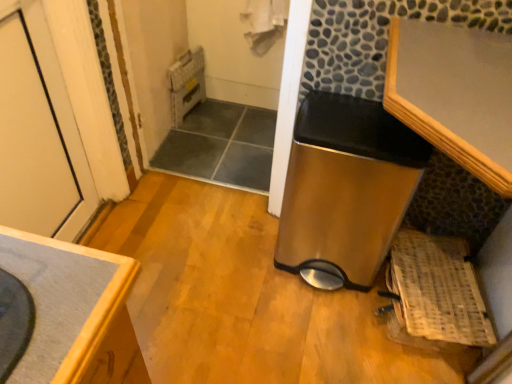
Question: In which direction should I rotate to look at stainless steel trash can at center, the 1th water heater positioned from the right?

Choices:
 (A) left
 (B) right

Answer: (B)

Question: From the image's perspective, is woven wood basket at lower right located beneath metallic gray water heater at upper center, which is the 2th water heater from bottom to top?

Choices:
 (A) no
 (B) yes

Answer: (B)

Question: Would you say metallic gray water heater at upper center, which is counted as the 2th water heater, starting from the front, is part of woven wood basket at lower right's contents?

Choices:
 (A) no
 (B) yes

Answer: (A)

Question: Considering the relative positions of woven wood basket at lower right and metallic gray water heater at upper center, which is the 1th water heater from top to bottom, in the image provided, is woven wood basket at lower right to the left of metallic gray water heater at upper center, which is the 1th water heater from top to bottom, from the viewer's perspective?

Choices:
 (A) yes
 (B) no

Answer: (B)

Question: Is woven wood basket at lower right bigger than metallic gray water heater at upper center, the 2th water heater from the right?

Choices:
 (A) no
 (B) yes

Answer: (B)

Question: Is metallic gray water heater at upper center, which is the 2th water heater from bottom to top, at the back of woven wood basket at lower right?

Choices:
 (A) yes
 (B) no

Answer: (B)

Question: Is there a large distance between woven wood basket at lower right and metallic gray water heater at upper center, the 2th water heater from the right?

Choices:
 (A) no
 (B) yes

Answer: (B)

Question: Is stainless steel trash can at center, which ranks as the 1th water heater in bottom-to-top order, smaller than metallic gray water heater at upper center, the first water heater viewed from the back?

Choices:
 (A) no
 (B) yes

Answer: (A)

Question: From a real-world perspective, is stainless steel trash can at center, the 1th water heater in the front-to-back sequence, physically above metallic gray water heater at upper center, which is counted as the 2th water heater, starting from the front?

Choices:
 (A) no
 (B) yes

Answer: (B)

Question: Is stainless steel trash can at center, arranged as the 2th water heater when viewed from the top, at the left side of metallic gray water heater at upper center, the first water heater viewed from the back?

Choices:
 (A) no
 (B) yes

Answer: (A)

Question: Is stainless steel trash can at center, the 1th water heater positioned from the right, bigger than metallic gray water heater at upper center, which is the 2th water heater from bottom to top?

Choices:
 (A) yes
 (B) no

Answer: (A)

Question: Is stainless steel trash can at center, arranged as the 2th water heater when viewed from the left, shorter than metallic gray water heater at upper center, the 2th water heater from the right?

Choices:
 (A) no
 (B) yes

Answer: (A)

Question: Is there a large distance between stainless steel trash can at center, the 1th water heater in the front-to-back sequence, and metallic gray water heater at upper center, the 2th water heater from the right?

Choices:
 (A) no
 (B) yes

Answer: (B)

Question: Does stainless steel trash can at center, the 1th water heater in the front-to-back sequence, have a greater height compared to woven wood basket at lower right?

Choices:
 (A) no
 (B) yes

Answer: (B)